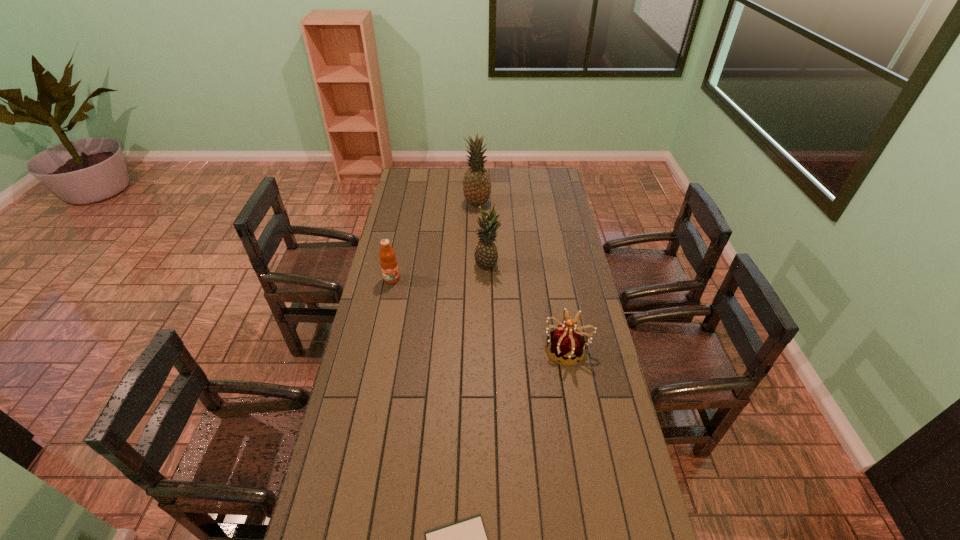
I want to click on the farthest object, so click(476, 183).

Where is `the farther pineapple`? The height and width of the screenshot is (540, 960). the farther pineapple is located at coordinates tap(476, 183).

The width and height of the screenshot is (960, 540). In order to click on the nearer pineapple in this screenshot , I will do `click(486, 255)`.

Find the location of a particular element. The width and height of the screenshot is (960, 540). the shorter pineapple is located at coordinates (486, 255).

The width and height of the screenshot is (960, 540). Find the location of `the third farthest object`. the third farthest object is located at coordinates (388, 261).

You are a GUI agent. You are given a task and a screenshot of the screen. Output one action in this format:
    pyautogui.click(x=<x>, y=<y>)
    Task: Click on the leftmost object
    The width and height of the screenshot is (960, 540).
    Given the screenshot: What is the action you would take?
    pyautogui.click(x=388, y=261)

Locate an element on the screen. Image resolution: width=960 pixels, height=540 pixels. the second nearest object is located at coordinates (567, 343).

Where is `tiara`? Image resolution: width=960 pixels, height=540 pixels. tiara is located at coordinates (567, 343).

The height and width of the screenshot is (540, 960). Find the location of `free location located on the front of the tallest object`. free location located on the front of the tallest object is located at coordinates (477, 238).

Identify the location of vacant point located 0.140m on the left of the shorter pineapple. The image size is (960, 540). (444, 264).